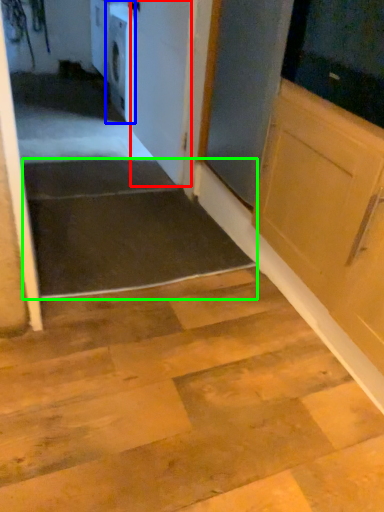
Question: Considering the real-world distances, which object is farthest from door (highlighted by a red box)? dish washer (highlighted by a blue box) or stairwell (highlighted by a green box)?

Choices:
 (A) dish washer
 (B) stairwell

Answer: (A)